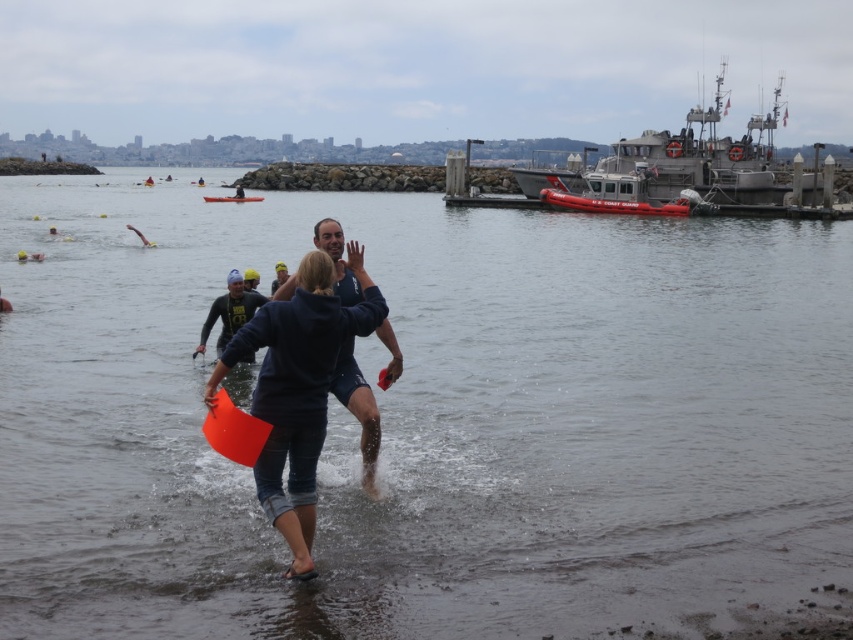
You are a photographer at the waterfront event. You want to take a photo that includes both the clear water at center and the orange plastic kayak at center. Which object should you frame larger in your shot to ensure both are visible?

The clear water at center is bigger than the orange plastic kayak at center, so you should frame the clear water at center larger to ensure both are visible.

You are standing at the waterfront and want to reach the point marked at coordinates point (282, 440). If you can swim 15 meters in 3 minutes, how long will it take you to reach that point?

The point (282, 440) is 15.53 meters from the viewer. Since you can swim 15 meters in 3 minutes, it will take approximately 3 minutes and 10 seconds to reach the point.

You are a photographer standing on the shore of the waterfront scene. You want to take a photo of the orange plastic kayak at center and the clear water at center. Which object should you focus on first if you want to capture both in the same frame without moving the camera?

The clear water at center is taller than the orange plastic kayak at center, so you should focus on the clear water at center first to ensure it is in focus before the kayak, as it occupies a larger portion of the frame.